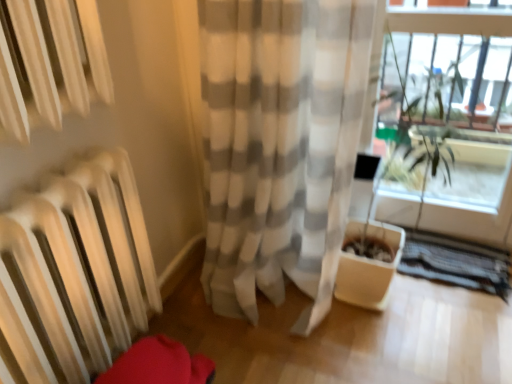
Question: Is the depth of clear glass window frame at upper right greater than that of white sheer curtain at center?

Choices:
 (A) yes
 (B) no

Answer: (A)

Question: Would you say clear glass window frame at upper right contains white sheer curtain at center?

Choices:
 (A) no
 (B) yes

Answer: (A)

Question: Is clear glass window frame at upper right to the right of white sheer curtain at center from the viewer's perspective?

Choices:
 (A) no
 (B) yes

Answer: (B)

Question: From the image's perspective, is clear glass window frame at upper right located beneath white sheer curtain at center?

Choices:
 (A) yes
 (B) no

Answer: (B)

Question: From a real-world perspective, is clear glass window frame at upper right below white sheer curtain at center?

Choices:
 (A) yes
 (B) no

Answer: (A)

Question: Does clear glass window frame at upper right appear on the left side of white sheer curtain at center?

Choices:
 (A) no
 (B) yes

Answer: (A)

Question: From the image's perspective, is white sheer curtain at center located beneath clear glass window frame at upper right?

Choices:
 (A) yes
 (B) no

Answer: (A)

Question: Does white sheer curtain at center turn towards clear glass window frame at upper right?

Choices:
 (A) yes
 (B) no

Answer: (B)

Question: Is white sheer curtain at center further to the viewer compared to clear glass window frame at upper right?

Choices:
 (A) yes
 (B) no

Answer: (B)

Question: Does white sheer curtain at center touch clear glass window frame at upper right?

Choices:
 (A) no
 (B) yes

Answer: (A)

Question: Can you confirm if white sheer curtain at center is positioned to the right of clear glass window frame at upper right?

Choices:
 (A) no
 (B) yes

Answer: (A)

Question: Is white sheer curtain at center looking in the opposite direction of clear glass window frame at upper right?

Choices:
 (A) no
 (B) yes

Answer: (A)

Question: Would you say white sheer curtain at center is inside or outside clear glass window frame at upper right?

Choices:
 (A) outside
 (B) inside

Answer: (A)